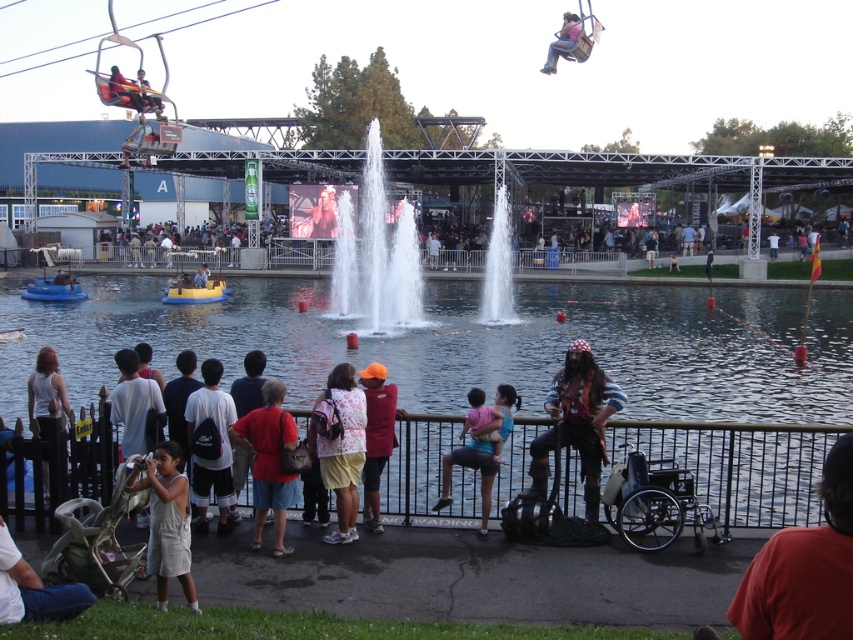
Question: Which object is farther from the camera taking this photo?

Choices:
 (A) matte pink shirt at upper center
 (B) matte black helmet at upper center

Answer: (B)

Question: Which point is closer to the camera?

Choices:
 (A) matte black helmet at upper center
 (B) blue denim jeans at center

Answer: (B)

Question: Is clear water jets at center positioned behind white fabric backpack at center?

Choices:
 (A) yes
 (B) no

Answer: (A)

Question: In this image, where is dark red shirt at lower right located relative to matte black helmet at upper center?

Choices:
 (A) above
 (B) below

Answer: (B)

Question: Which point is farther to the camera?

Choices:
 (A) red cotton shirt at lower center
 (B) light beige overalls at lower left
 (C) matte black helmet at upper center
 (D) light blue shirt at lower left

Answer: (C)

Question: Is orange fabric vest at center smaller than matte black helmet at upper center?

Choices:
 (A) yes
 (B) no

Answer: (A)